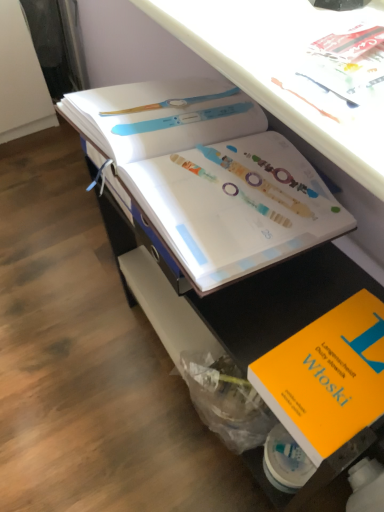
Question: From a real-world perspective, is orange matte book at lower right, which ranks as the 1th book in bottom-to-top order, physically located above or below white paper book at center, marked as the second book in a bottom-to-top arrangement?

Choices:
 (A) above
 (B) below

Answer: (B)

Question: In the image, is orange matte book at lower right, which ranks as the 1th book in bottom-to-top order, positioned in front of or behind white paper book at center, marked as the second book in a bottom-to-top arrangement?

Choices:
 (A) behind
 (B) front

Answer: (B)

Question: Does point (354, 323) appear closer or farther from the camera than point (294, 229)?

Choices:
 (A) closer
 (B) farther

Answer: (A)

Question: Is white paper book at center, marked as the second book in a bottom-to-top arrangement, in front of or behind orange matte book at lower right, the 2th book when ordered from top to bottom, in the image?

Choices:
 (A) front
 (B) behind

Answer: (B)

Question: From the image's perspective, is white paper book at center, marked as the second book in a bottom-to-top arrangement, located above or below orange matte book at lower right, the 2th book when ordered from top to bottom?

Choices:
 (A) above
 (B) below

Answer: (A)

Question: From a real-world perspective, relative to orange matte book at lower right, which ranks as the 1th book in bottom-to-top order, is white paper book at center, which appears as the first book when viewed from the top, vertically above or below?

Choices:
 (A) below
 (B) above

Answer: (B)

Question: In terms of size, does white paper book at center, which appears as the first book when viewed from the top, appear bigger or smaller than orange matte book at lower right, which ranks as the 1th book in bottom-to-top order?

Choices:
 (A) small
 (B) big

Answer: (B)